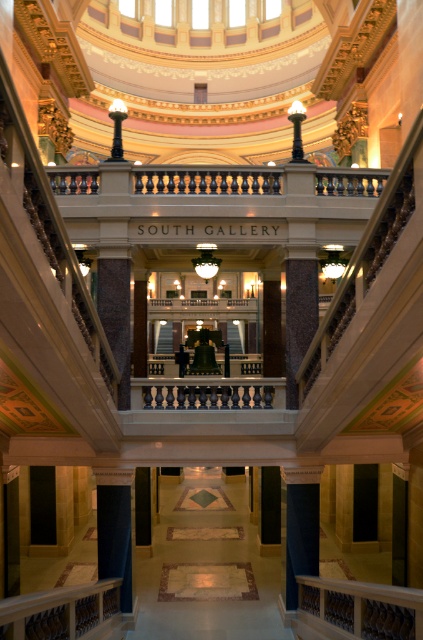
Measure the distance from polished marble staircase at right to wooden balustrade at lower right.

polished marble staircase at right is 5.10 meters away from wooden balustrade at lower right.

Does polished marble staircase at right have a smaller size compared to wooden balustrade at lower right?

Incorrect, polished marble staircase at right is not smaller in size than wooden balustrade at lower right.

Is point (376, 230) farther from camera compared to point (409, 618)?

Yes, it is behind point (409, 618).

Identify the location of polished marble staircase at right. The width and height of the screenshot is (423, 640). (362, 268).

Locate an element on the screen. wooden balustrade at lower right is located at coordinates (362, 608).

Does wooden balustrade at lower right have a lesser height compared to marble floor at center?

No, wooden balustrade at lower right is not shorter than marble floor at center.

Is point (382, 612) positioned in front of point (250, 592)?

Yes.

Locate an element on the screen. The image size is (423, 640). wooden balustrade at lower right is located at coordinates (362, 608).

Is point (340, 316) closer to viewer compared to point (183, 573)?

That is True.

Which is more to the right, polished marble staircase at right or marble floor at center?

Positioned to the right is polished marble staircase at right.

Who is more distant from viewer, (387,195) or (241,572)?

Positioned behind is point (241,572).

This screenshot has width=423, height=640. In order to click on polished marble staircase at right in this screenshot , I will do `click(362, 268)`.